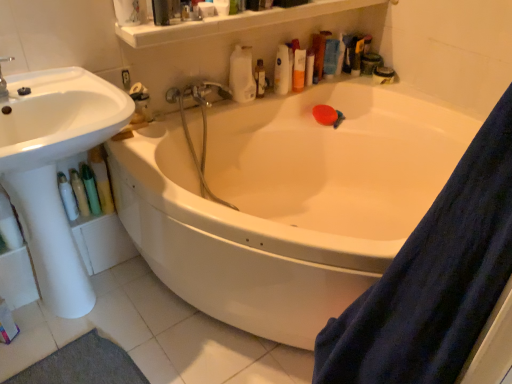
Where is `vacant space behind brushed metal faucet at upper left`? This screenshot has width=512, height=384. vacant space behind brushed metal faucet at upper left is located at coordinates (28, 86).